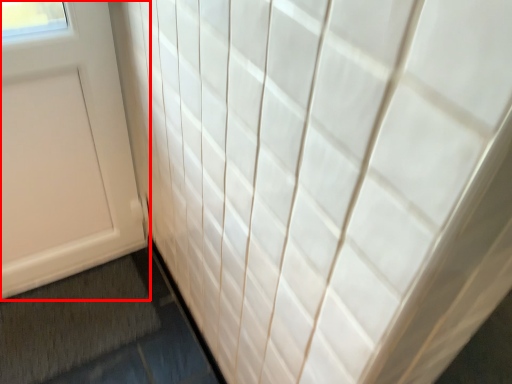
Question: Where is door (annotated by the red box) located in relation to bath mat in the image?

Choices:
 (A) left
 (B) right

Answer: (A)